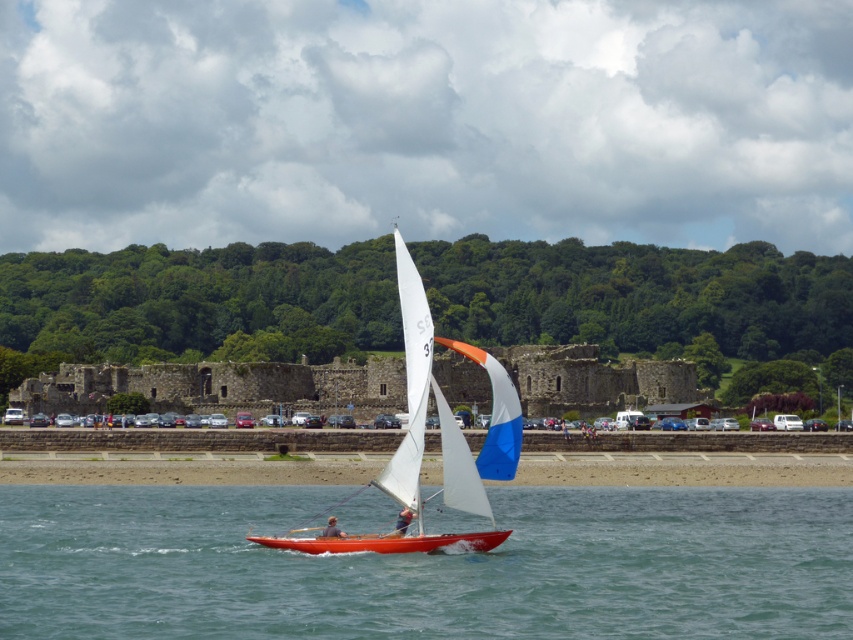
Question: Is smooth sand beach at lower center to the left of blue fabric sail at center from the viewer's perspective?

Choices:
 (A) no
 (B) yes

Answer: (A)

Question: Is clear blue water at center wider than orange fabric sailboat at center?

Choices:
 (A) no
 (B) yes

Answer: (B)

Question: Based on their relative distances, which object is nearer to the orange matte kayak at center?

Choices:
 (A) orange fabric sailboat at center
 (B) orange matte sailboat at center

Answer: (A)

Question: Is clear blue water at center positioned before orange matte sailboat at center?

Choices:
 (A) yes
 (B) no

Answer: (A)

Question: Which object is farther from the camera taking this photo?

Choices:
 (A) orange matte kayak at center
 (B) clear blue water at center
 (C) orange fabric sailboat at center

Answer: (C)

Question: Estimate the real-world distances between objects in this image. Which object is closer to the smooth sand beach at lower center?

Choices:
 (A) orange matte sailboat at center
 (B) orange fabric sailboat at center

Answer: (A)